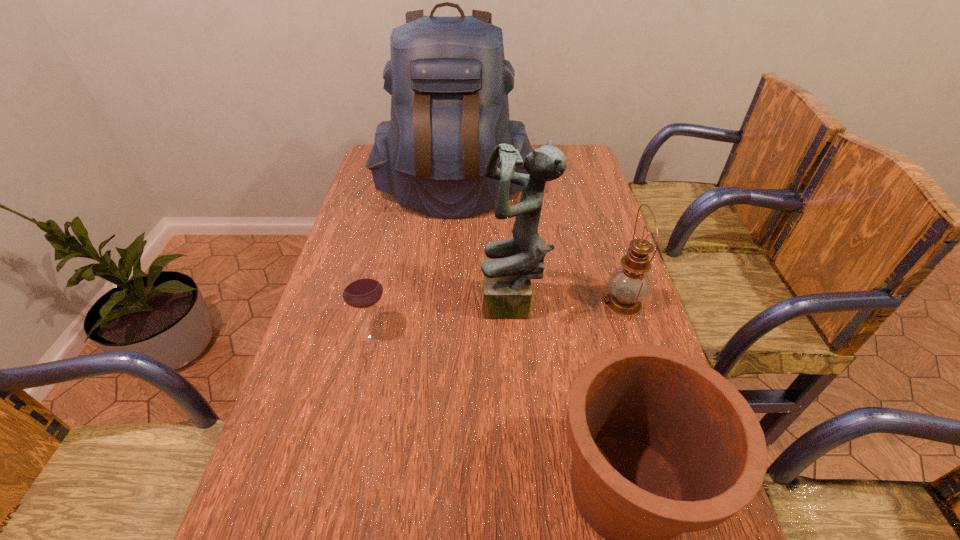
Image resolution: width=960 pixels, height=540 pixels. What are the coordinates of `free space between the tallest object and the sculpture` in the screenshot? It's located at click(483, 249).

Image resolution: width=960 pixels, height=540 pixels. Find the location of `free space between the oil lamp and the fourth shortest object`. free space between the oil lamp and the fourth shortest object is located at coordinates (568, 305).

Image resolution: width=960 pixels, height=540 pixels. What are the coordinates of `free spot between the tallest object and the second tallest object` in the screenshot? It's located at (483, 249).

Identify which object is the nearest to the backpack. Please provide its 2D coordinates. Your answer should be formatted as a tuple, i.e. [(x, y)], where the tuple contains the x and y coordinates of a point satisfying the conditions above.

[(507, 293)]

Identify the location of object that is the closest to the wineglass. The height and width of the screenshot is (540, 960). (507, 293).

This screenshot has width=960, height=540. What are the coordinates of `free location that satisfies the following two spatial constraints: 1. at the front pocket of the oil lamp; 2. on the right side of the tallest object` in the screenshot? It's located at (444, 303).